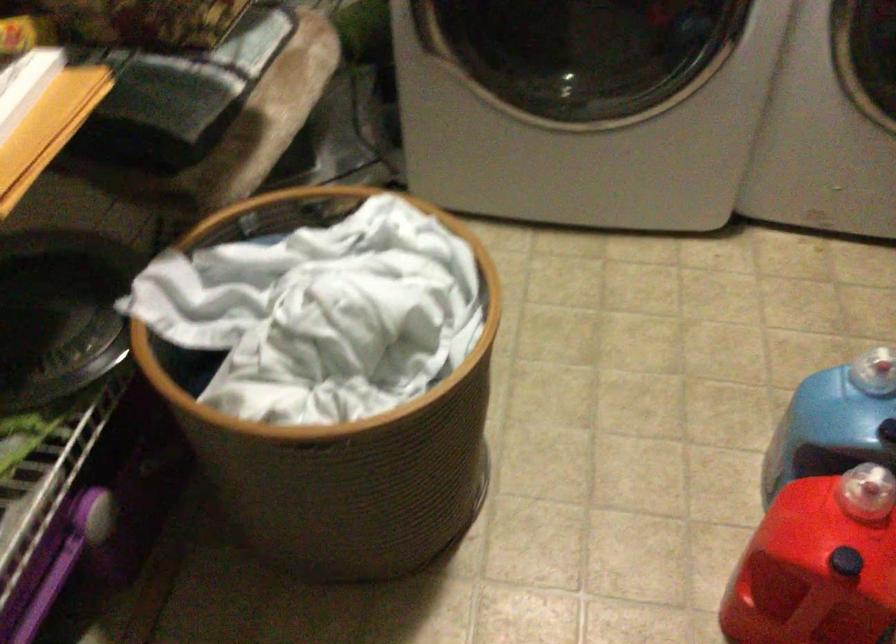
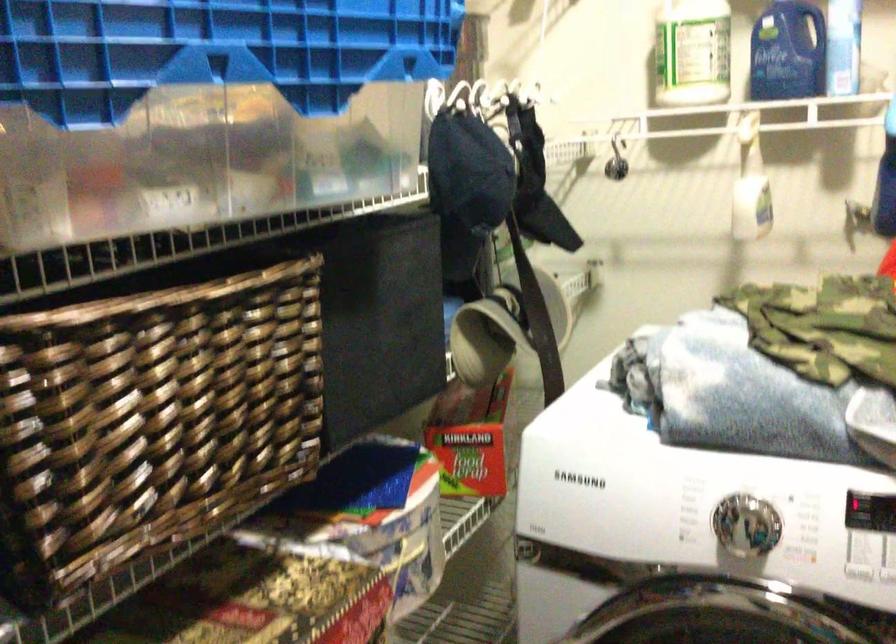
First-person continuous shooting, in which direction is the camera rotating?

The rotation direction of the camera is left-up.